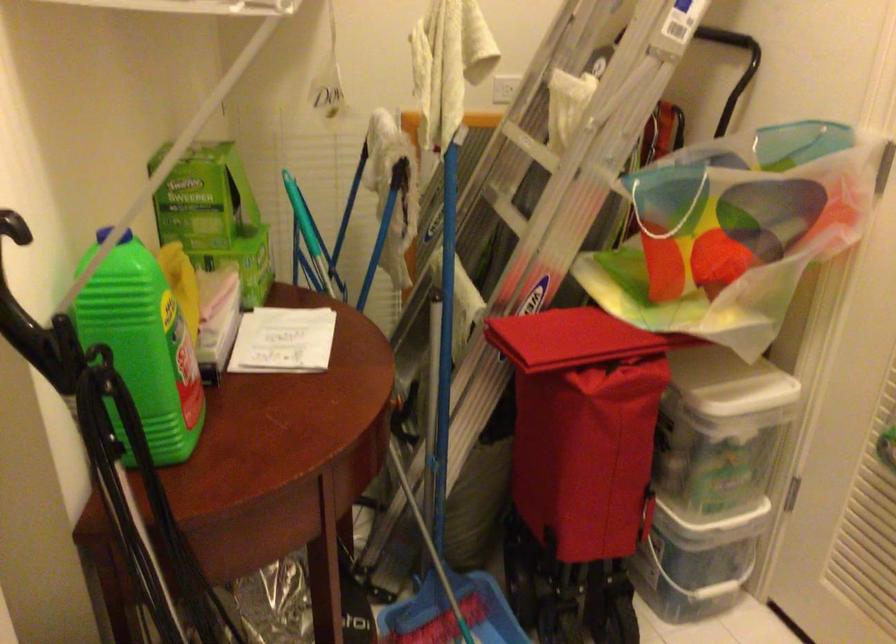
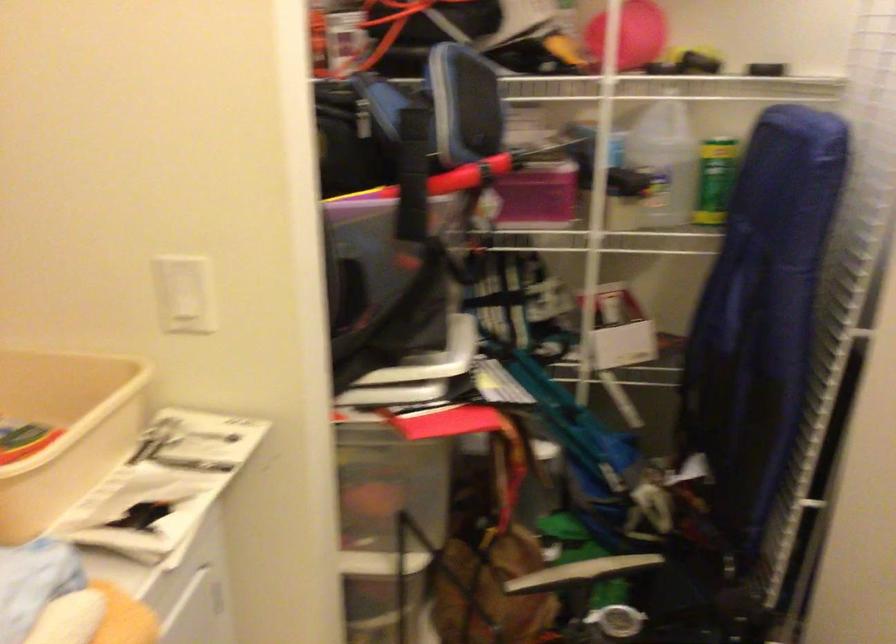
First-person continuous shooting, in which direction is the camera rotating?

The rotation direction of the camera is left-down.